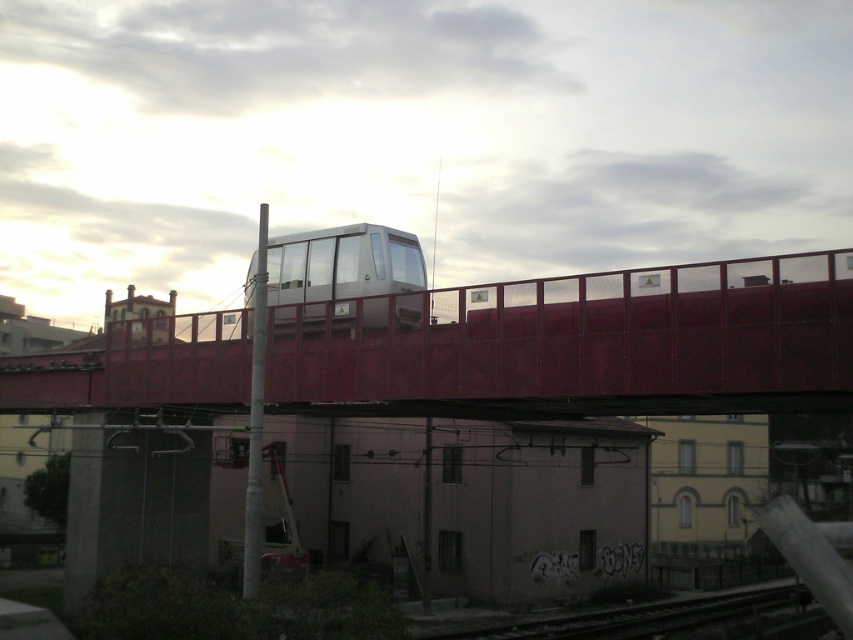
From the picture: You are a passenger on the metallic silver train at center and want to see the metallic red bridge at center. Since the train is moving forward, will the bridge become visible or disappear from your view?

The metallic red bridge at center is in front of the metallic silver train at center, so as the train moves forward, the bridge will become visible ahead.